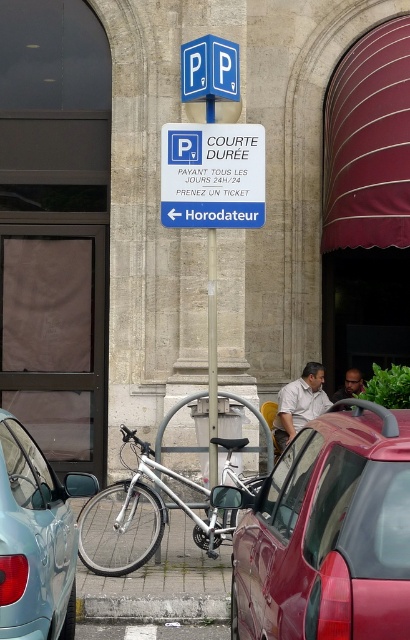
You are a pedestrian trying to park your bicycle near the parking sign. The light blue matte car at lower left and the light brown shirt at center are in the way. Which object is closer to the ground?

The light blue matte car at lower left is closer to the ground because it is below the light brown shirt at center.

You are a delivery person who needs to park your bicycle. You see the silver metallic bicycle at center and the light brown shirt at center. Which object is taller? Please answer based on the scene description.

The silver metallic bicycle at center is taller than the light brown shirt at center.

Looking at this image, you are a pedestrian observing two shirts hanging on a clothesline in front of the parking sign. Which shirt has a larger size between the light brown shirt at center and the matte black shirt at center?

The light brown shirt at center is bigger than the matte black shirt at center.